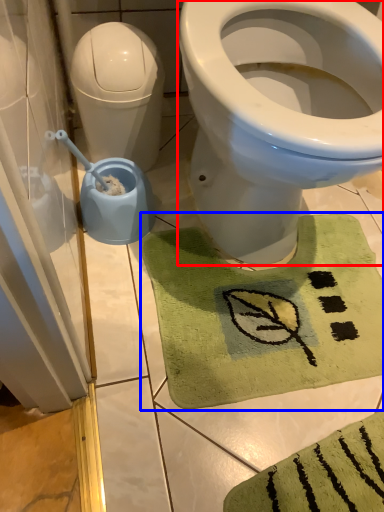
Question: Which of the following is the closest to the observer, bidet (highlighted by a red box) or bath mat (highlighted by a blue box)?

Choices:
 (A) bidet
 (B) bath mat

Answer: (A)